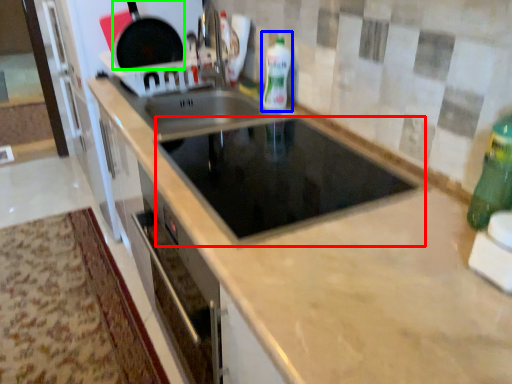
Question: Considering the real-world distances, which object is farthest from appliance (highlighted by a red box)? bottle (highlighted by a blue box) or frying pan (highlighted by a green box)?

Choices:
 (A) bottle
 (B) frying pan

Answer: (B)